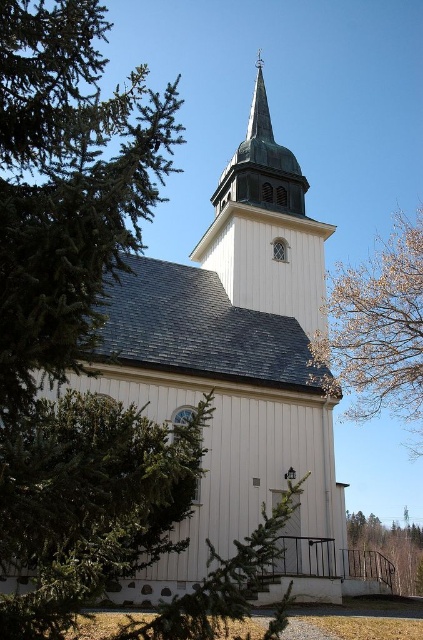
Question: Does green needle-like leaves at left have a larger size compared to white wooden steeple at upper center?

Choices:
 (A) yes
 (B) no

Answer: (A)

Question: Which point is closer to the camera?

Choices:
 (A) (264, 140)
 (B) (395, 525)
 (C) (115, 260)

Answer: (C)

Question: Which object is closer to the camera taking this photo?

Choices:
 (A) green leafy tree at lower right
 (B) white wooden church at center
 (C) bare branches at upper right

Answer: (B)

Question: Considering the relative positions of white wooden steeple at upper center and green leafy tree at lower right in the image provided, where is white wooden steeple at upper center located with respect to green leafy tree at lower right?

Choices:
 (A) above
 (B) below

Answer: (A)

Question: Which object is closer to the camera taking this photo?

Choices:
 (A) white wooden steeple at upper center
 (B) green leafy tree at lower right
 (C) green needle-like leaves at left
 (D) bare branches at upper right

Answer: (C)

Question: Does white wooden steeple at upper center have a larger size compared to green leafy tree at lower right?

Choices:
 (A) yes
 (B) no

Answer: (A)